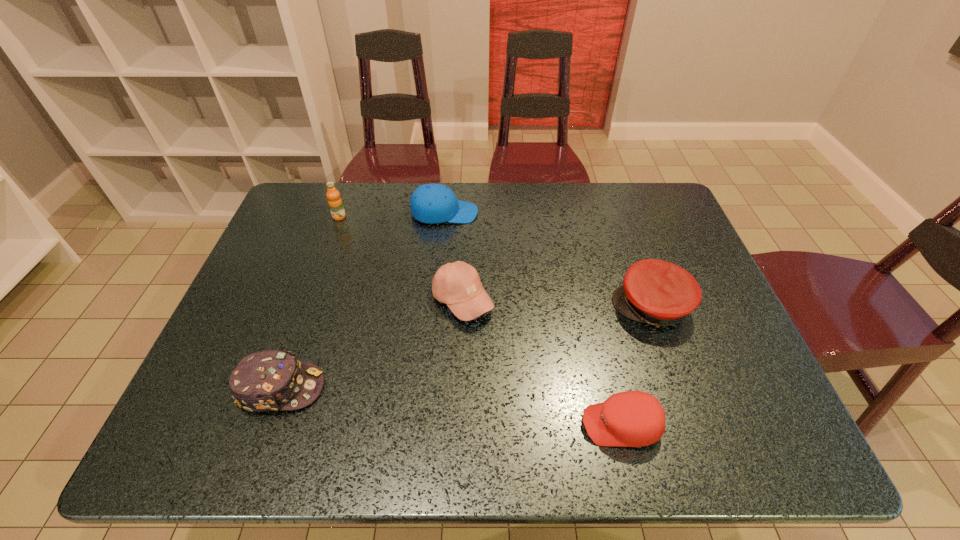
Image resolution: width=960 pixels, height=540 pixels. Find the location of `free spot located on the front of the third nearest cap with an emblem`. free spot located on the front of the third nearest cap with an emblem is located at coordinates (480, 307).

Locate an element on the screen. The height and width of the screenshot is (540, 960). vacant space located 0.060m on the front-facing side of the leftmost cap is located at coordinates (351, 388).

Find the location of a particular element. The image size is (960, 540). orange juice present at the far edge is located at coordinates (335, 203).

This screenshot has width=960, height=540. What are the coordinates of `cap positioned at the far edge` in the screenshot? It's located at click(433, 203).

The image size is (960, 540). What are the coordinates of `orange juice situated at the left edge` in the screenshot? It's located at (335, 203).

This screenshot has height=540, width=960. Find the location of `headwear present at the left edge`. headwear present at the left edge is located at coordinates (271, 380).

The image size is (960, 540). In order to click on object at the right edge in this screenshot , I will do `click(656, 292)`.

Locate an element on the screen. object that is at the far left corner is located at coordinates (335, 203).

The height and width of the screenshot is (540, 960). I want to click on object that is at the near left corner, so [x=271, y=380].

This screenshot has width=960, height=540. I want to click on vacant space at the far edge of the desktop, so click(505, 184).